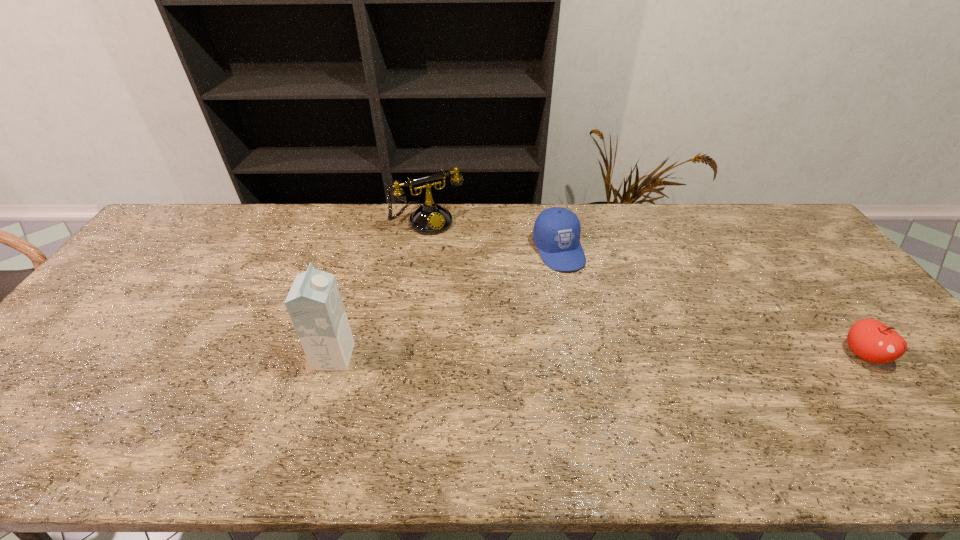
The height and width of the screenshot is (540, 960). I want to click on vacant space located on the front-facing side of the third object from left to right, so click(586, 301).

You are a GUI agent. You are given a task and a screenshot of the screen. Output one action in this format:
    pyautogui.click(x=<x>, y=<y>)
    Task: Click on the vacant space located 0.100m on the dial of the third shortest object
    
    Given the screenshot: What is the action you would take?
    pyautogui.click(x=455, y=251)

Where is `vacant space positioned on the dial of the third shortest object`? This screenshot has height=540, width=960. vacant space positioned on the dial of the third shortest object is located at coordinates (450, 244).

Identify the location of vacant space located on the dial of the third shortest object. The width and height of the screenshot is (960, 540). (468, 270).

The height and width of the screenshot is (540, 960). Find the location of `cap at the far edge`. cap at the far edge is located at coordinates (556, 234).

Identify the location of telephone located in the far edge section of the desktop. The width and height of the screenshot is (960, 540). (430, 218).

Locate an element on the screen. The width and height of the screenshot is (960, 540). object that is at the right edge is located at coordinates (871, 340).

This screenshot has width=960, height=540. I want to click on blank space at the far edge, so click(x=758, y=240).

Locate an element on the screen. The image size is (960, 540). free space at the near edge of the desktop is located at coordinates (276, 396).

Identify the location of vacant position at the left edge of the desktop. (152, 266).